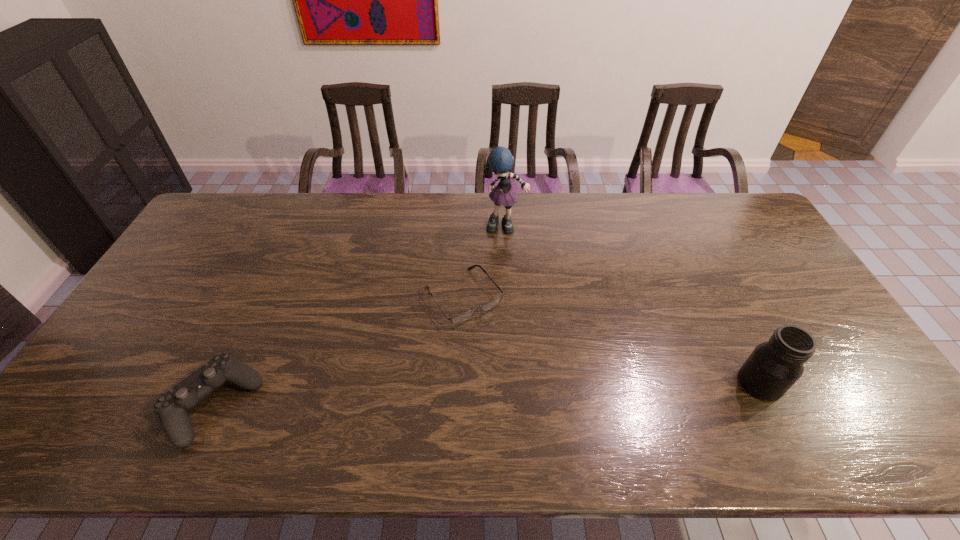
Locate an element on the screen. the second shortest object is located at coordinates (172, 407).

Where is `the leftmost object`? the leftmost object is located at coordinates (172, 407).

In order to click on the rightmost object in this screenshot , I will do `click(774, 366)`.

The image size is (960, 540). I want to click on the third shortest object, so click(x=774, y=366).

Locate an element on the screen. The width and height of the screenshot is (960, 540). spectacles is located at coordinates (462, 317).

You are a GUI agent. You are given a task and a screenshot of the screen. Output one action in this format:
    pyautogui.click(x=<x>, y=<y>)
    Task: Click on the shortest object
    The width and height of the screenshot is (960, 540).
    Given the screenshot: What is the action you would take?
    pyautogui.click(x=462, y=317)

Image resolution: width=960 pixels, height=540 pixels. What are the coordinates of `rag doll` in the screenshot? It's located at (501, 161).

This screenshot has height=540, width=960. Find the location of `the farthest object`. the farthest object is located at coordinates (501, 161).

You are a GUI agent. You are given a task and a screenshot of the screen. Output one action in this format:
    pyautogui.click(x=<x>, y=<y>)
    Task: Click on the free space located 0.270m on the right of the leftmost object
    The width and height of the screenshot is (960, 540).
    Given the screenshot: What is the action you would take?
    pyautogui.click(x=369, y=404)

You are a GUI agent. You are given a task and a screenshot of the screen. Output one action in this format:
    pyautogui.click(x=<x>, y=<y>)
    Task: Click on the free space located 0.110m on the back of the rightmost object
    This screenshot has width=960, height=540.
    Given the screenshot: What is the action you would take?
    pyautogui.click(x=734, y=331)